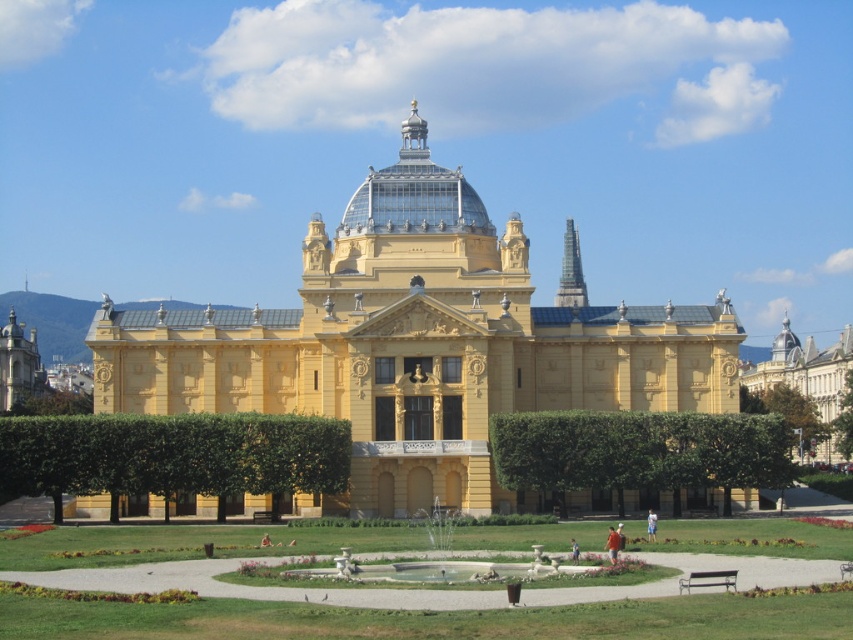
You are standing in the garden in front of the yellow matte building at center. If you face the building, which direction should you walk to reach the fountain located in the central area?

The fountain is centrally located in the garden area in front of the yellow matte building at center, so you should walk straight towards the building to reach the central fountain.

You are standing in front of the grand building and see a blue fabric shirt at center and a blue fabric person at center. Which one is positioned higher from the ground?

The blue fabric shirt at center is positioned higher from the ground because it is located above the blue fabric person at center.